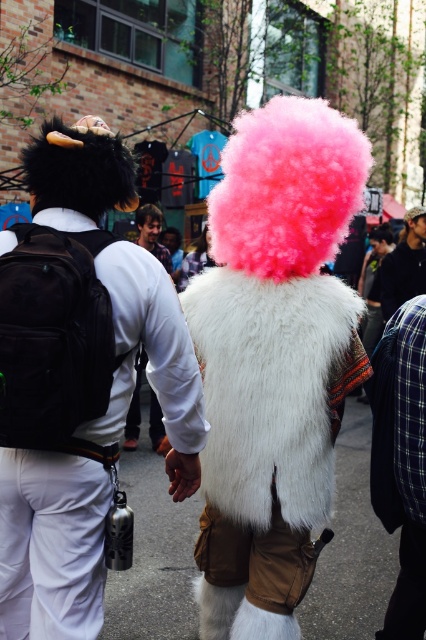
You are a photographer at the festival trying to capture both the fuzzy white fur coat at center and the white furry vest at center in a single frame. Since you want to emphasize the size difference between them, which one should you position closer to the camera to achieve this effect?

To emphasize the size difference between the fuzzy white fur coat at center and the white furry vest at center, you should position the fuzzy white fur coat at center closer to the camera since it is larger in size than the white furry vest at center.

You are a photographer trying to capture both the white furry vest at center and the pink fluffy wig at upper center in a single shot. However, your camera can only focus on one subject at a time. Based on their positions, which subject should you focus on to ensure the other remains in the background?

You should focus on the white furry vest at center because it is in front of the pink fluffy wig at upper center, so the pink fluffy wig at upper center will naturally be in the background.

You are a photographer trying to capture both the white fur coat at center and the pink fluffy wig at upper center in a single shot. Which object should you adjust your camera focus on first to ensure both are in frame?

The white fur coat at center is closer to the viewer than the pink fluffy wig at upper center, so you should focus on the white fur coat at center first to ensure both are in frame.